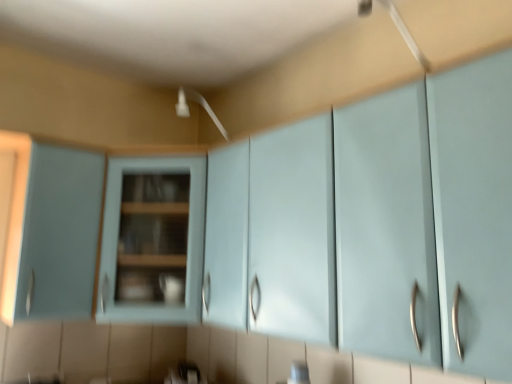
The image size is (512, 384). What do you see at coordinates (152, 240) in the screenshot?
I see `matte blue cabinet at center, the second cabinetry when ordered from left to right` at bounding box center [152, 240].

The height and width of the screenshot is (384, 512). I want to click on matte blue cabinet at center, the second cabinetry when ordered from left to right, so click(x=152, y=240).

At what (x,y) coordinates should I click in order to perform the action: click on matte light blue cabinet at left, which ranks as the first cabinetry in left-to-right order. Please return your answer as a coordinate pair (x, y). The height and width of the screenshot is (384, 512). Looking at the image, I should click on (51, 231).

What do you see at coordinates (51, 231) in the screenshot?
I see `matte light blue cabinet at left, the second cabinetry from the right` at bounding box center [51, 231].

You are a GUI agent. You are given a task and a screenshot of the screen. Output one action in this format:
    pyautogui.click(x=<x>, y=<y>)
    Task: Click on the matte blue cabinet at center, the second cabinetry when ordered from left to right
    
    Given the screenshot: What is the action you would take?
    pyautogui.click(x=152, y=240)

Is matte blue cabinet at center, which is counted as the first cabinetry, starting from the right, at the left side of matte light blue cabinet at left, which ranks as the first cabinetry in left-to-right order?

Incorrect, matte blue cabinet at center, which is counted as the first cabinetry, starting from the right, is not on the left side of matte light blue cabinet at left, which ranks as the first cabinetry in left-to-right order.

Is matte blue cabinet at center, the second cabinetry when ordered from left to right, in front of or behind matte light blue cabinet at left, which ranks as the first cabinetry in left-to-right order, in the image?

Visually, matte blue cabinet at center, the second cabinetry when ordered from left to right, is located in front of matte light blue cabinet at left, which ranks as the first cabinetry in left-to-right order.

Considering the points (127, 285) and (10, 284), which point is behind, point (127, 285) or point (10, 284)?

The point (127, 285) is farther.

From the image's perspective, is matte blue cabinet at center, which is counted as the first cabinetry, starting from the right, above or below matte light blue cabinet at left, the second cabinetry from the right?

matte blue cabinet at center, which is counted as the first cabinetry, starting from the right, is situated lower than matte light blue cabinet at left, the second cabinetry from the right, in the image.

From a real-world perspective, which is physically above, matte blue cabinet at center, which is counted as the first cabinetry, starting from the right, or matte light blue cabinet at left, which ranks as the first cabinetry in left-to-right order?

In real-world perspective, matte light blue cabinet at left, which ranks as the first cabinetry in left-to-right order, is above.

Which object is thinner, matte blue cabinet at center, which is counted as the first cabinetry, starting from the right, or matte light blue cabinet at left, which ranks as the first cabinetry in left-to-right order?

matte light blue cabinet at left, which ranks as the first cabinetry in left-to-right order.

Who is taller, matte blue cabinet at center, the second cabinetry when ordered from left to right, or matte light blue cabinet at left, which ranks as the first cabinetry in left-to-right order?

matte light blue cabinet at left, which ranks as the first cabinetry in left-to-right order.

Does matte blue cabinet at center, which is counted as the first cabinetry, starting from the right, have a larger size compared to matte light blue cabinet at left, the second cabinetry from the right?

Correct, matte blue cabinet at center, which is counted as the first cabinetry, starting from the right, is larger in size than matte light blue cabinet at left, the second cabinetry from the right.

Would you say matte blue cabinet at center, which is counted as the first cabinetry, starting from the right, is inside or outside matte light blue cabinet at left, which ranks as the first cabinetry in left-to-right order?

matte blue cabinet at center, which is counted as the first cabinetry, starting from the right, cannot be found inside matte light blue cabinet at left, which ranks as the first cabinetry in left-to-right order.

Is matte blue cabinet at center, the second cabinetry when ordered from left to right, touching matte light blue cabinet at left, which ranks as the first cabinetry in left-to-right order?

There is a gap between matte blue cabinet at center, the second cabinetry when ordered from left to right, and matte light blue cabinet at left, which ranks as the first cabinetry in left-to-right order.

Is matte blue cabinet at center, the second cabinetry when ordered from left to right, facing towards matte light blue cabinet at left, which ranks as the first cabinetry in left-to-right order?

No.

Locate an element on the screen. cabinetry behind the matte blue cabinet at center, the second cabinetry when ordered from left to right is located at coordinates (51, 231).

Is matte light blue cabinet at left, the second cabinetry from the right, at the right side of matte blue cabinet at center, which is counted as the first cabinetry, starting from the right?

No.

Considering the positions of objects matte light blue cabinet at left, which ranks as the first cabinetry in left-to-right order, and matte blue cabinet at center, which is counted as the first cabinetry, starting from the right, in the image provided, who is in front, matte light blue cabinet at left, which ranks as the first cabinetry in left-to-right order, or matte blue cabinet at center, which is counted as the first cabinetry, starting from the right,?

matte blue cabinet at center, which is counted as the first cabinetry, starting from the right, is in front.

Does point (10, 267) lie in front of point (184, 173)?

Yes, it is in front of point (184, 173).

From the image's perspective, between matte light blue cabinet at left, the second cabinetry from the right, and matte blue cabinet at center, the second cabinetry when ordered from left to right, who is located below?

From the image's view, matte blue cabinet at center, the second cabinetry when ordered from left to right, is below.

From a real-world perspective, between matte light blue cabinet at left, which ranks as the first cabinetry in left-to-right order, and matte blue cabinet at center, which is counted as the first cabinetry, starting from the right, who is vertically lower?

matte blue cabinet at center, which is counted as the first cabinetry, starting from the right, from a real-world perspective.

Looking at this image, considering the sizes of matte light blue cabinet at left, which ranks as the first cabinetry in left-to-right order, and matte blue cabinet at center, the second cabinetry when ordered from left to right, in the image, is matte light blue cabinet at left, which ranks as the first cabinetry in left-to-right order, wider or thinner than matte blue cabinet at center, the second cabinetry when ordered from left to right,?

In the image, matte light blue cabinet at left, which ranks as the first cabinetry in left-to-right order, appears to be more narrow than matte blue cabinet at center, the second cabinetry when ordered from left to right.

Between matte light blue cabinet at left, which ranks as the first cabinetry in left-to-right order, and matte blue cabinet at center, which is counted as the first cabinetry, starting from the right, which one has less height?

With less height is matte blue cabinet at center, which is counted as the first cabinetry, starting from the right.

Can you confirm if matte light blue cabinet at left, which ranks as the first cabinetry in left-to-right order, is bigger than matte blue cabinet at center, the second cabinetry when ordered from left to right?

No, matte light blue cabinet at left, which ranks as the first cabinetry in left-to-right order, is not bigger than matte blue cabinet at center, the second cabinetry when ordered from left to right.

Would you say matte light blue cabinet at left, the second cabinetry from the right, is inside or outside matte blue cabinet at center, which is counted as the first cabinetry, starting from the right?

The correct answer is: outside.

Are matte light blue cabinet at left, the second cabinetry from the right, and matte blue cabinet at center, which is counted as the first cabinetry, starting from the right, beside each other?

No, matte light blue cabinet at left, the second cabinetry from the right, is not beside matte blue cabinet at center, which is counted as the first cabinetry, starting from the right.

Is matte blue cabinet at center, the second cabinetry when ordered from left to right, at the back of matte light blue cabinet at left, the second cabinetry from the right?

No, matte light blue cabinet at left, the second cabinetry from the right, is not facing the opposite direction of matte blue cabinet at center, the second cabinetry when ordered from left to right.

What's the angular difference between matte light blue cabinet at left, which ranks as the first cabinetry in left-to-right order, and matte blue cabinet at center, which is counted as the first cabinetry, starting from the right,'s facing directions?

The facing directions of matte light blue cabinet at left, which ranks as the first cabinetry in left-to-right order, and matte blue cabinet at center, which is counted as the first cabinetry, starting from the right, are 0.000134 degrees apart.

Find the location of a particular element. The width and height of the screenshot is (512, 384). cabinetry on the right of matte light blue cabinet at left, the second cabinetry from the right is located at coordinates (152, 240).

Where is `cabinetry that appears on the right of matte light blue cabinet at left, the second cabinetry from the right`? Image resolution: width=512 pixels, height=384 pixels. cabinetry that appears on the right of matte light blue cabinet at left, the second cabinetry from the right is located at coordinates point(152,240).

Locate an element on the screen. cabinetry above the matte blue cabinet at center, the second cabinetry when ordered from left to right (from a real-world perspective) is located at coordinates (51, 231).